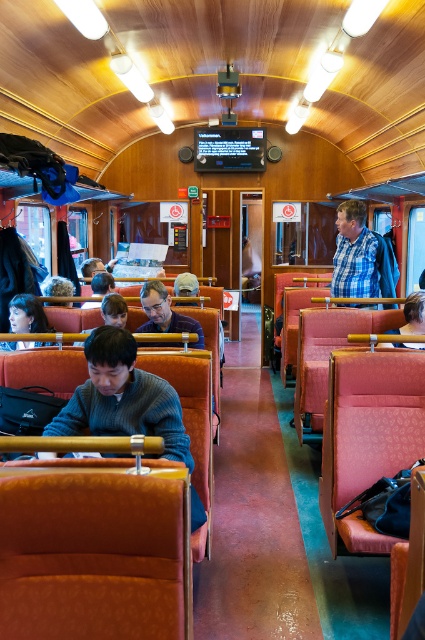
Question: Is matte black sweater at center bigger than matte black hair at lower left?

Choices:
 (A) no
 (B) yes

Answer: (B)

Question: Which of the following is the closest to the observer?

Choices:
 (A) matte black hair at lower left
 (B) matte black sweater at center

Answer: (B)

Question: In this image, where is matte black sweater at center located relative to matte black hair at lower left?

Choices:
 (A) right
 (B) left

Answer: (A)

Question: Does matte black sweater at center have a lesser width compared to matte black hair at lower left?

Choices:
 (A) yes
 (B) no

Answer: (B)

Question: Which point is farther to the camera?

Choices:
 (A) (45, 323)
 (B) (149, 298)

Answer: (A)

Question: Which object is farther from the camera taking this photo?

Choices:
 (A) matte black hair at lower left
 (B) matte black sweater at center

Answer: (A)